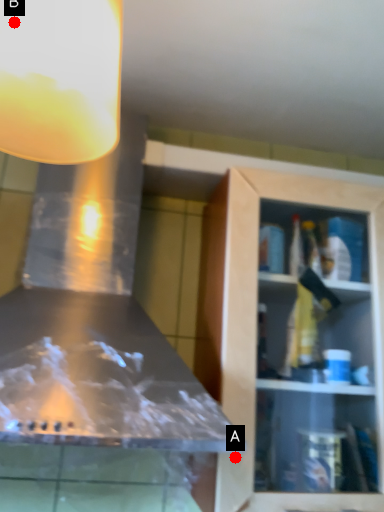
Question: Two points are circled on the image, labeled by A and B beside each circle. Which of the following is the closest to the observer?

Choices:
 (A) A is closer
 (B) B is closer

Answer: (B)